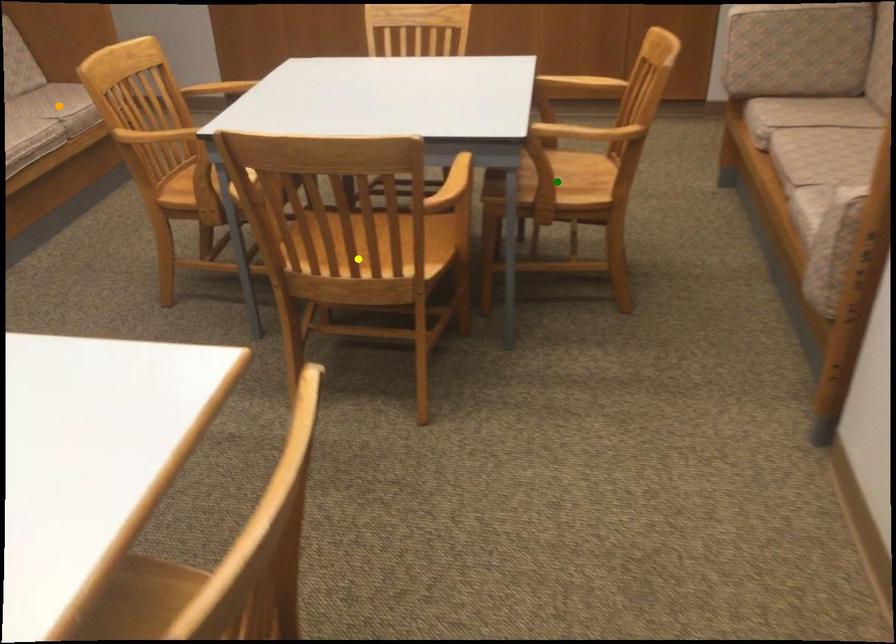
Order these from farthest to nearest:
A) orange point
B) yellow point
C) green point

orange point < green point < yellow point